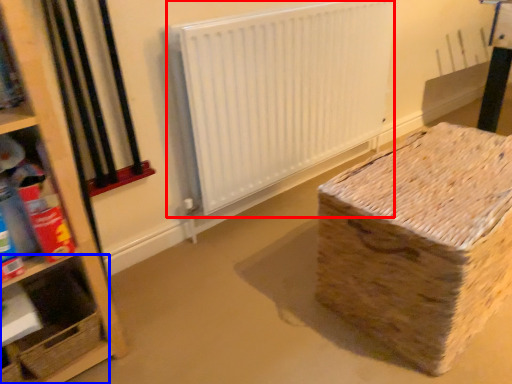
Question: Which object is further to the camera taking this photo, radiator (highlighted by a red box) or shelf (highlighted by a blue box)?

Choices:
 (A) radiator
 (B) shelf

Answer: (A)